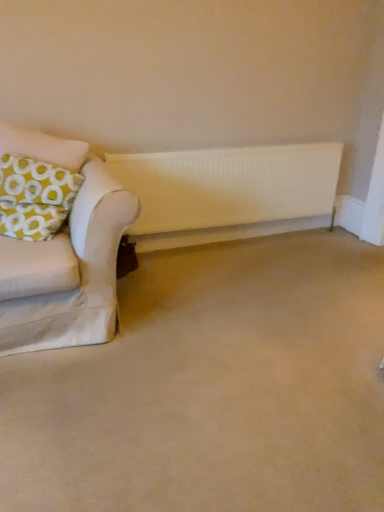
Question: Is beige carpet at lower center aimed at white matte radiator at center?

Choices:
 (A) no
 (B) yes

Answer: (A)

Question: Considering the relative positions of beige carpet at lower center and white matte radiator at center in the image provided, is beige carpet at lower center to the left of white matte radiator at center from the viewer's perspective?

Choices:
 (A) yes
 (B) no

Answer: (B)

Question: From a real-world perspective, is beige carpet at lower center beneath white matte radiator at center?

Choices:
 (A) no
 (B) yes

Answer: (B)

Question: From a real-world perspective, is beige carpet at lower center physically above white matte radiator at center?

Choices:
 (A) yes
 (B) no

Answer: (B)

Question: From the image's perspective, is beige carpet at lower center beneath white matte radiator at center?

Choices:
 (A) no
 (B) yes

Answer: (B)

Question: From their relative heights in the image, would you say yellow-green fabric pillow at left is taller or shorter than white matte radiator at center?

Choices:
 (A) tall
 (B) short

Answer: (B)

Question: Which is correct: yellow-green fabric pillow at left is inside white matte radiator at center, or outside of it?

Choices:
 (A) outside
 (B) inside

Answer: (A)

Question: From a real-world perspective, is yellow-green fabric pillow at left positioned above or below white matte radiator at center?

Choices:
 (A) below
 (B) above

Answer: (B)

Question: Is point (6, 179) closer or farther from the camera than point (311, 168)?

Choices:
 (A) farther
 (B) closer

Answer: (B)

Question: Relative to beige carpet at lower center, is white matte radiator at center in front or behind?

Choices:
 (A) behind
 (B) front

Answer: (A)

Question: From their relative heights in the image, would you say white matte radiator at center is taller or shorter than beige carpet at lower center?

Choices:
 (A) short
 (B) tall

Answer: (B)

Question: Is white matte radiator at center inside or outside of beige carpet at lower center?

Choices:
 (A) outside
 (B) inside

Answer: (A)

Question: From the image's perspective, is white matte radiator at center positioned above or below beige carpet at lower center?

Choices:
 (A) above
 (B) below

Answer: (A)

Question: Considering the positions of beige carpet at lower center and white matte radiator at center in the image, is beige carpet at lower center wider or thinner than white matte radiator at center?

Choices:
 (A) thin
 (B) wide

Answer: (B)

Question: Would you say beige carpet at lower center is to the left or to the right of white matte radiator at center in the picture?

Choices:
 (A) right
 (B) left

Answer: (A)